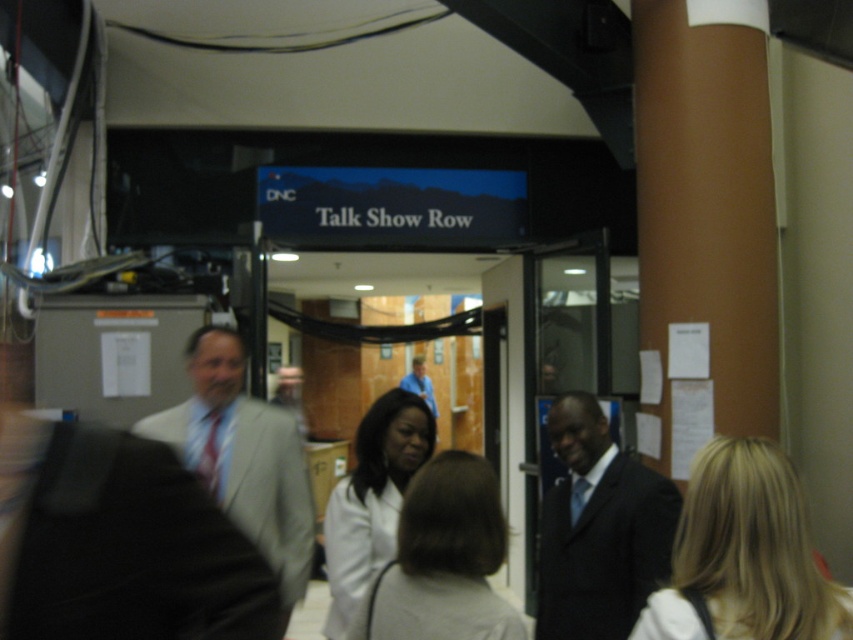
Question: Which is nearer to the white matte coat at center?

Choices:
 (A) light gray suit at center
 (B) blue fabric shirt at center
 (C) blonde hair at upper right
 (D) light brown hair at center

Answer: (D)

Question: Which of these objects is positioned farthest from the white matte coat at center?

Choices:
 (A) blonde hair at upper right
 (B) light gray suit at center

Answer: (A)

Question: Does dark blue suit at center come in front of light brown hair at center?

Choices:
 (A) no
 (B) yes

Answer: (A)

Question: Is light gray suit at center in front of light brown hair at center?

Choices:
 (A) no
 (B) yes

Answer: (A)

Question: Which point is closer to the camera?

Choices:
 (A) (405, 380)
 (B) (810, 556)
 (C) (384, 518)

Answer: (B)

Question: Is blonde hair at upper right closer to the viewer compared to light brown hair at center?

Choices:
 (A) yes
 (B) no

Answer: (A)